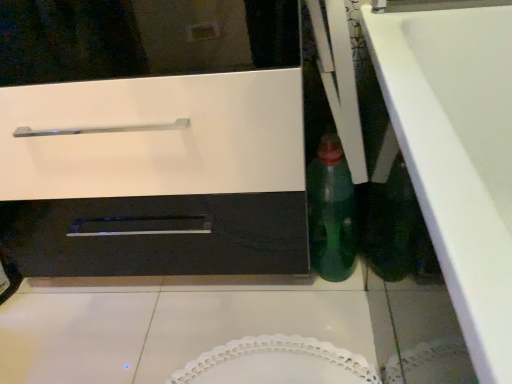
Locate an element on the screen. This screenshot has width=512, height=384. free space to the left of green glass bottle at center-right is located at coordinates (275, 294).